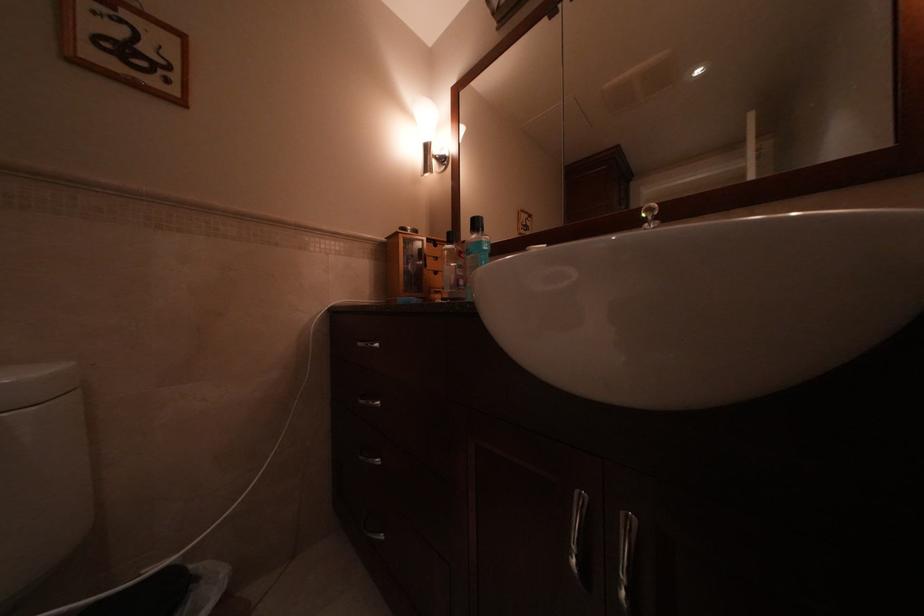
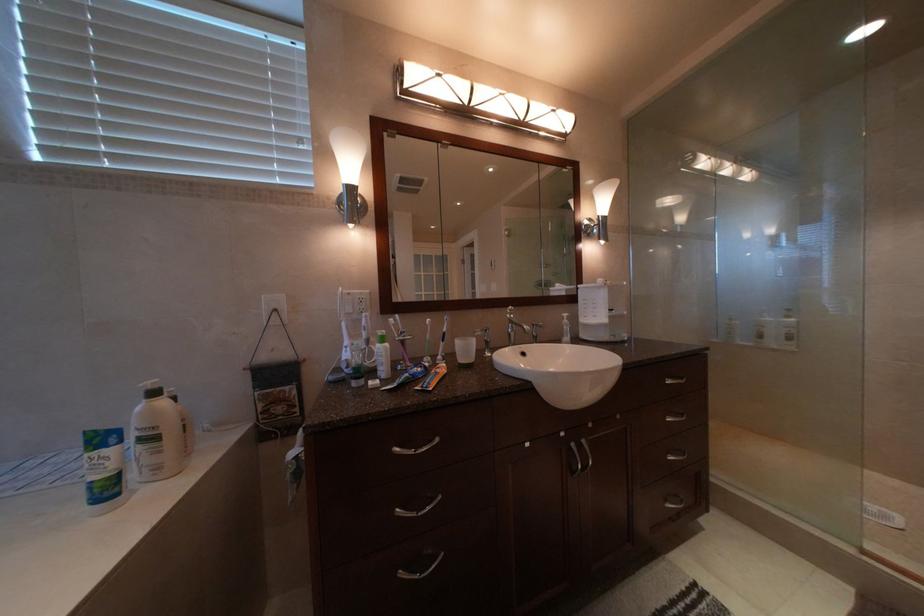
What movement of the cameraman would produce the second image?

The movement direction of the cameraman is left, backward.